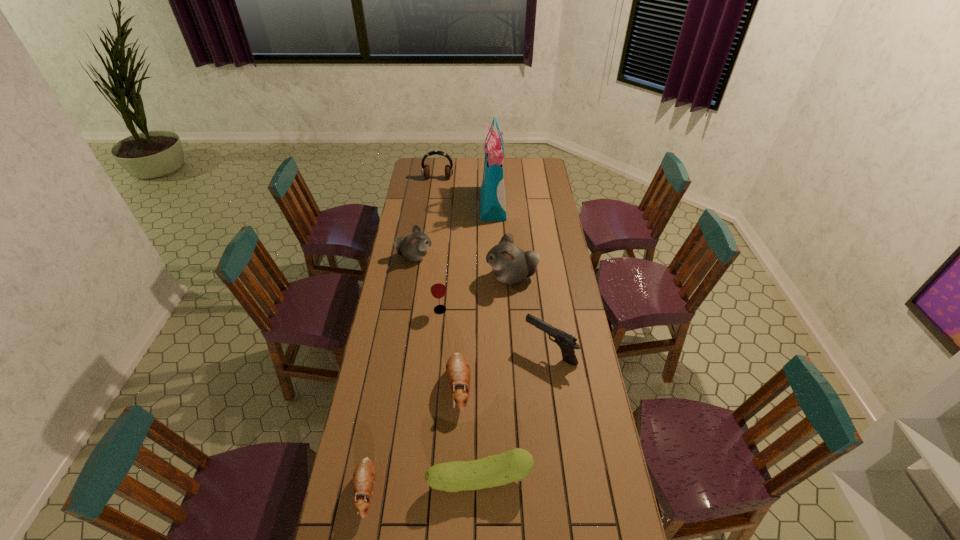
Identify the location of vacant area in the image that satisfies the following two spatial constraints: 1. on the ear cup of the headset; 2. on the right side of the glass. (421, 310).

Locate an element on the screen. Image resolution: width=960 pixels, height=540 pixels. free spot that satisfies the following two spatial constraints: 1. on the face of the rightmost hamster; 2. on the front side of the glass is located at coordinates (514, 310).

Identify the location of free region that satisfies the following two spatial constraints: 1. on the face of the smaller white hamster; 2. at the face of the smaller brown hamster. (376, 490).